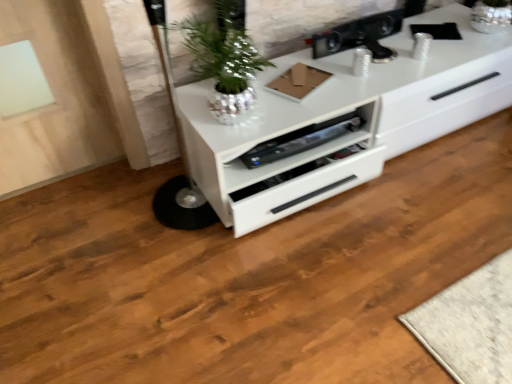
The height and width of the screenshot is (384, 512). Find the location of `free spot above white glossy chest of drawers at center (from a real-world perspective)`. free spot above white glossy chest of drawers at center (from a real-world perspective) is located at coordinates (362, 53).